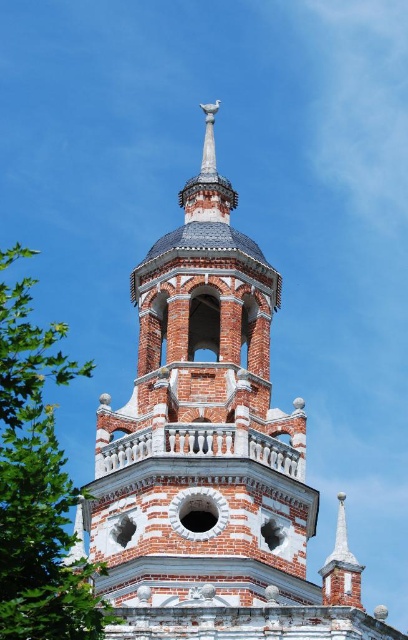
Question: Among these objects, which one is farthest from the camera?

Choices:
 (A) red brick tower at center
 (B) green leafy tree at left

Answer: (A)

Question: Which point appears farthest from the camera in this image?

Choices:
 (A) coord(40,579)
 (B) coord(310,627)

Answer: (B)

Question: Is red brick tower at center closer to camera compared to green leafy tree at left?

Choices:
 (A) yes
 (B) no

Answer: (B)

Question: From the image, what is the correct spatial relationship of red brick tower at center in relation to green leafy tree at left?

Choices:
 (A) left
 (B) right

Answer: (B)

Question: Is red brick tower at center positioned before green leafy tree at left?

Choices:
 (A) no
 (B) yes

Answer: (A)